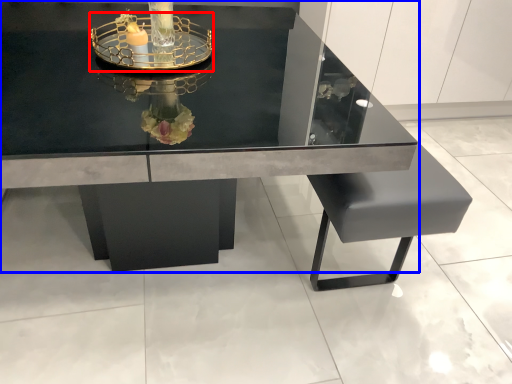
Question: Which object is further to the camera taking this photo, glass box (highlighted by a red box) or table (highlighted by a blue box)?

Choices:
 (A) glass box
 (B) table

Answer: (A)